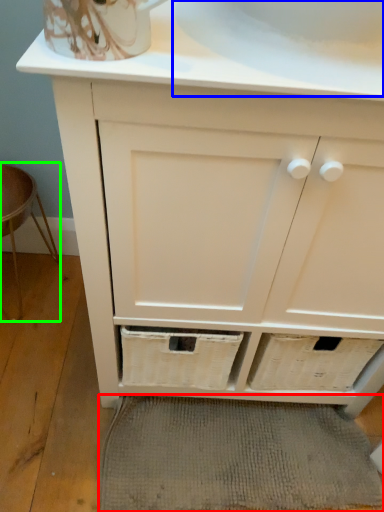
Question: Which is nearer to the bath mat (highlighted by a red box)? sink (highlighted by a blue box) or bar stool (highlighted by a green box).

Choices:
 (A) sink
 (B) bar stool

Answer: (B)